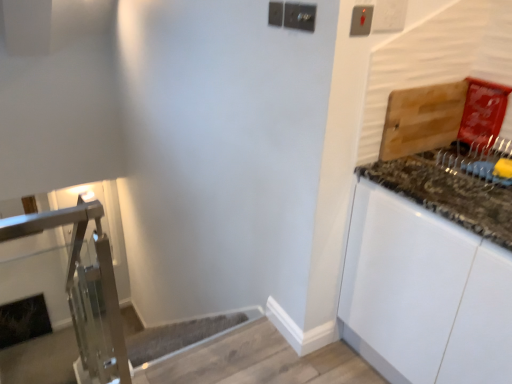
This screenshot has width=512, height=384. What do you see at coordinates (450, 189) in the screenshot?
I see `granite countertop at right` at bounding box center [450, 189].

The height and width of the screenshot is (384, 512). I want to click on granite countertop at right, so click(450, 189).

Identify the location of granite countertop at right. (450, 189).